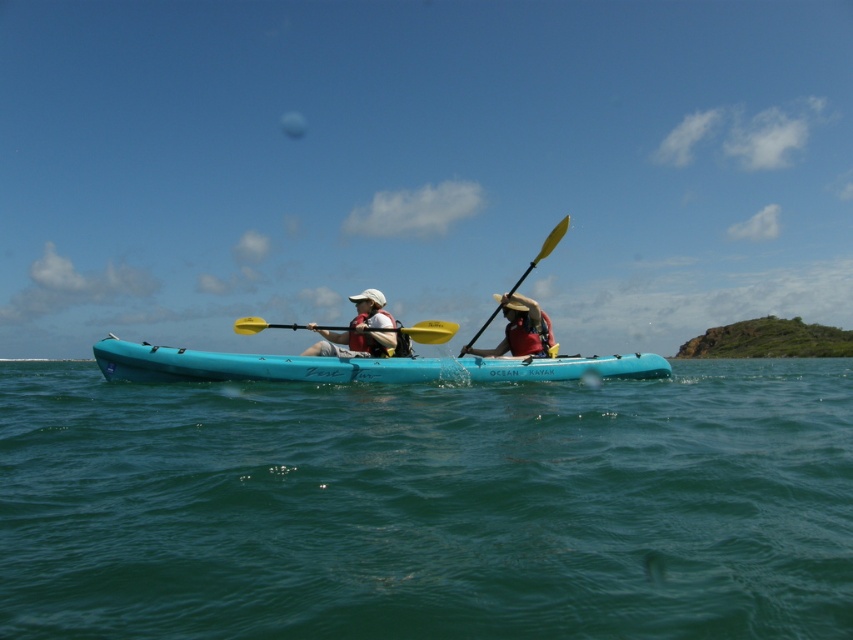
Question: Is green water at center further to camera compared to yellow matte paddle at center?

Choices:
 (A) no
 (B) yes

Answer: (A)

Question: Among these objects, which one is nearest to the camera?

Choices:
 (A) yellow plastic paddle at center
 (B) red fabric hat at center

Answer: (A)

Question: Does matte white helmet at center appear on the left side of yellow matte paddle at center?

Choices:
 (A) no
 (B) yes

Answer: (B)

Question: Which point is closer to the camera?

Choices:
 (A) (360, 312)
 (B) (200, 360)
 (C) (537, 262)
 (D) (549, 342)

Answer: (B)

Question: Which point is closer to the camera?

Choices:
 (A) (477, 333)
 (B) (328, 378)
 (C) (227, 572)

Answer: (C)

Question: Can you confirm if teal rubber kayak at center is positioned to the right of yellow plastic paddle at center?

Choices:
 (A) yes
 (B) no

Answer: (A)